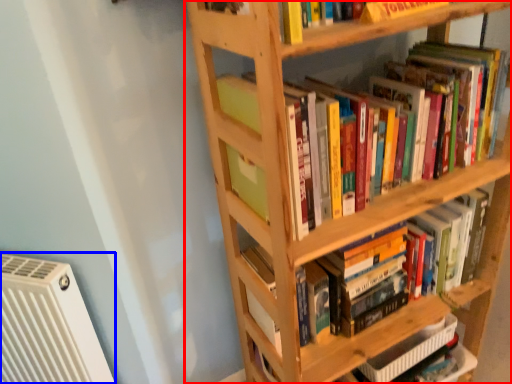
Question: Which object is further to the camera taking this photo, shelf (highlighted by a red box) or air conditioning (highlighted by a blue box)?

Choices:
 (A) shelf
 (B) air conditioning

Answer: (B)